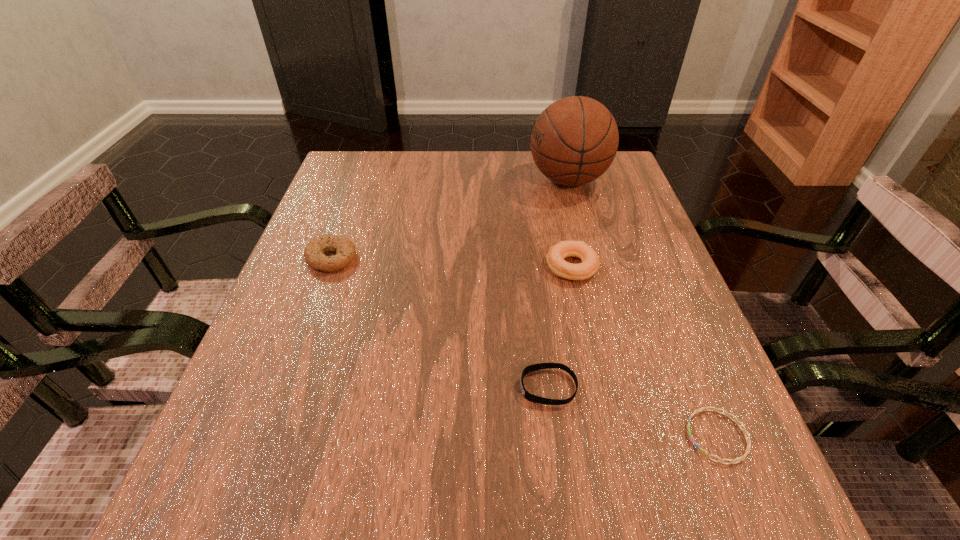
Where is `the tallest object`? the tallest object is located at coordinates (575, 139).

Locate an element on the screen. The image size is (960, 540). the farthest object is located at coordinates (575, 139).

You are a GUI agent. You are given a task and a screenshot of the screen. Output one action in this format:
    pyautogui.click(x=<x>, y=<y>)
    Task: Click on the right bagel
    The height and width of the screenshot is (540, 960).
    Given the screenshot: What is the action you would take?
    pyautogui.click(x=590, y=263)

The image size is (960, 540). Find the location of `the leftmost object`. the leftmost object is located at coordinates (344, 248).

What are the coordinates of `the fourth farthest object` in the screenshot? It's located at (530, 397).

Identify the location of the fourth tallest object. The width and height of the screenshot is (960, 540). (530, 397).

Find the location of a particular element. The image size is (960, 540). the shortest object is located at coordinates (726, 413).

Identify the location of bracelet. (726, 413).

Where is `vacant space located on the side with brand label of the basketball`? vacant space located on the side with brand label of the basketball is located at coordinates (387, 179).

Identify the location of free space located on the side with brand label of the basketball. (482, 179).